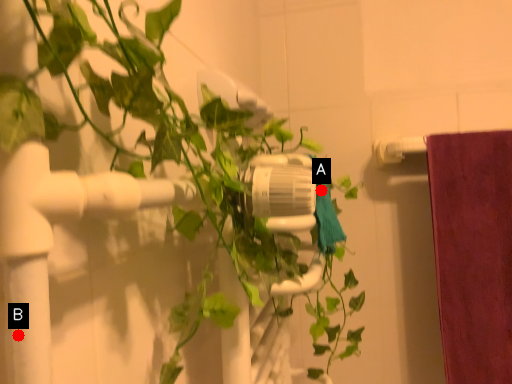
Question: Two points are circled on the image, labeled by A and B beside each circle. Which point is closer to the camera?

Choices:
 (A) A is closer
 (B) B is closer

Answer: (B)